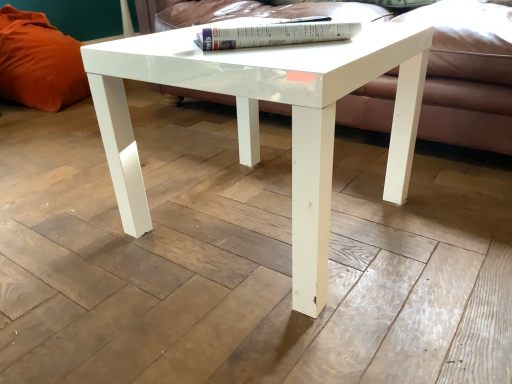
The image size is (512, 384). I want to click on vacant space to the left of white glossy book at upper center, so click(148, 43).